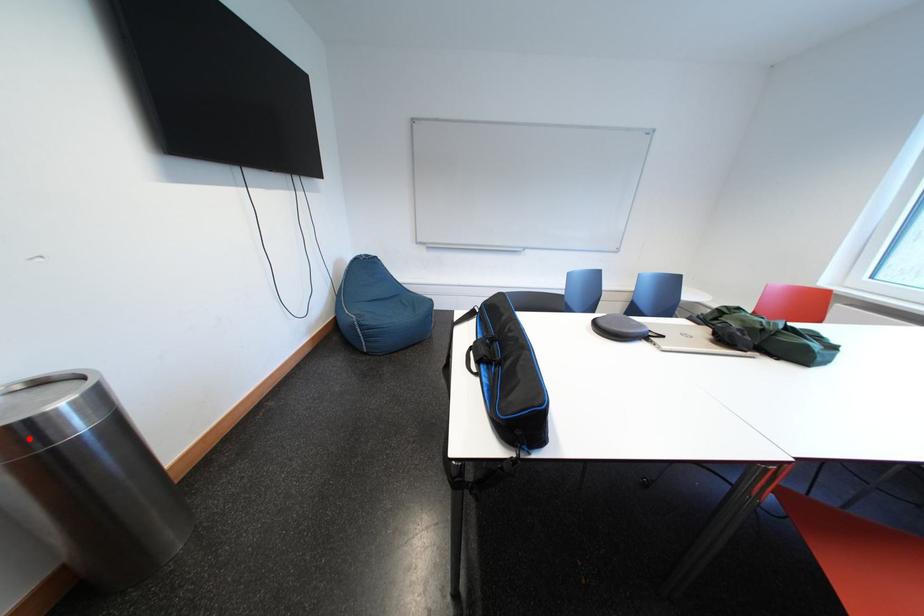
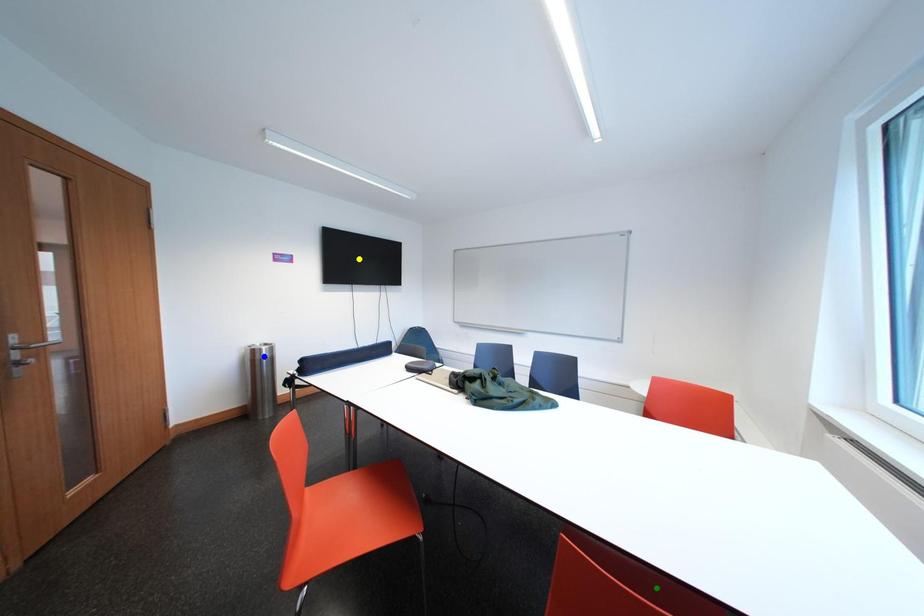
Question: I am providing you with two images of the same scene from different viewpoints. A red point is marked on the first image. You are given multiple points on the second image. Which mark in image 2 goes with the point in image 1?

Choices:
 (A) yellow point
 (B) blue point
 (C) green point

Answer: (B)